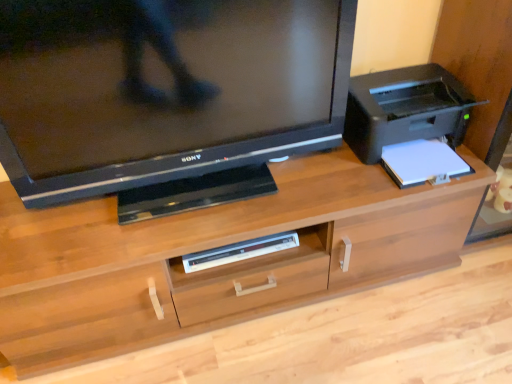
Question: Considering the positions of matte black television at upper left and wooden desk at center in the image, is matte black television at upper left taller or shorter than wooden desk at center?

Choices:
 (A) tall
 (B) short

Answer: (A)

Question: Which is correct: matte black television at upper left is inside wooden desk at center, or outside of it?

Choices:
 (A) outside
 (B) inside

Answer: (A)

Question: Estimate the real-world distances between objects in this image. Which object is farther from the white plastic dvd player at center?

Choices:
 (A) wooden desk at center
 (B) matte black television at upper left

Answer: (B)

Question: Which object is the closest to the wooden desk at center?

Choices:
 (A) white plastic dvd player at center
 (B) matte black television at upper left

Answer: (A)